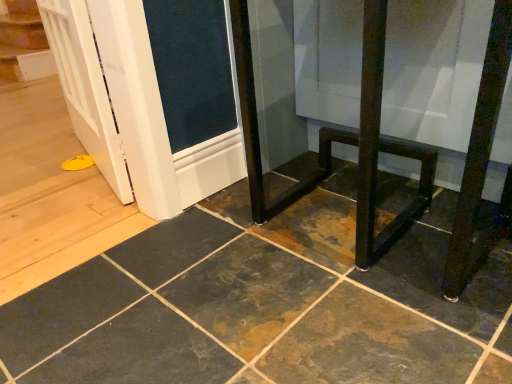
Question: Is black metal table at lower right surrounding rustic slate tile at center?

Choices:
 (A) yes
 (B) no

Answer: (B)

Question: Can you confirm if black metal table at lower right is positioned to the right of rustic slate tile at center?

Choices:
 (A) yes
 (B) no

Answer: (A)

Question: Is black metal table at lower right aimed at rustic slate tile at center?

Choices:
 (A) yes
 (B) no

Answer: (B)

Question: Can you confirm if black metal table at lower right is shorter than rustic slate tile at center?

Choices:
 (A) yes
 (B) no

Answer: (B)

Question: Considering the relative sizes of black metal table at lower right and rustic slate tile at center in the image provided, is black metal table at lower right bigger than rustic slate tile at center?

Choices:
 (A) yes
 (B) no

Answer: (A)

Question: Is black metal table at lower right at the left side of rustic slate tile at center?

Choices:
 (A) no
 (B) yes

Answer: (A)

Question: From the image's perspective, is rustic slate tile at center located beneath black metal table at lower right?

Choices:
 (A) no
 (B) yes

Answer: (B)

Question: Is rustic slate tile at center not close to black metal table at lower right?

Choices:
 (A) no
 (B) yes

Answer: (A)

Question: From a real-world perspective, is rustic slate tile at center physically below black metal table at lower right?

Choices:
 (A) no
 (B) yes

Answer: (B)

Question: Considering the relative sizes of rustic slate tile at center and black metal table at lower right in the image provided, is rustic slate tile at center taller than black metal table at lower right?

Choices:
 (A) no
 (B) yes

Answer: (A)

Question: Is rustic slate tile at center bigger than black metal table at lower right?

Choices:
 (A) yes
 (B) no

Answer: (B)

Question: Does rustic slate tile at center come behind black metal table at lower right?

Choices:
 (A) yes
 (B) no

Answer: (B)

Question: Considering their positions, is rustic slate tile at center located in front of or behind black metal table at lower right?

Choices:
 (A) behind
 (B) front

Answer: (B)